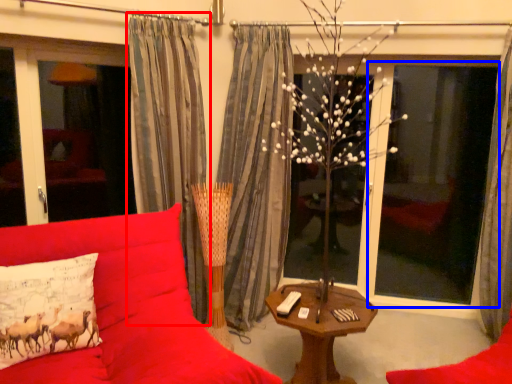
Question: Among these objects, which one is nearest to the camera, curtain (highlighted by a red box) or window screen (highlighted by a blue box)?

Choices:
 (A) curtain
 (B) window screen

Answer: (A)